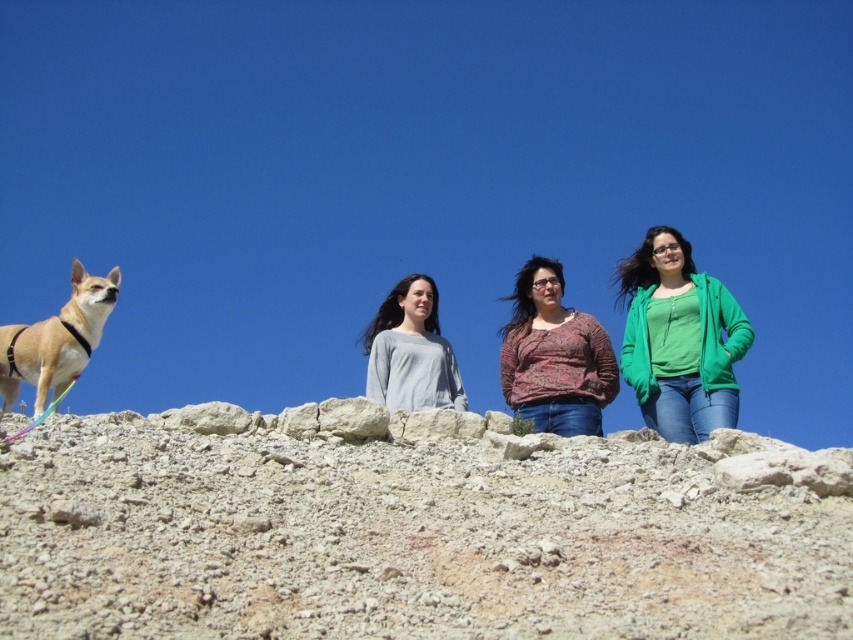
Question: Can you confirm if gray matte shirt at center is positioned to the right of light brown fur at left?

Choices:
 (A) yes
 (B) no

Answer: (A)

Question: Which point is closer to the camera?

Choices:
 (A) (718, 285)
 (B) (535, 472)

Answer: (B)

Question: Which object is positioned farthest from the printed cotton shirt at center?

Choices:
 (A) rough textured dirt at center
 (B) light brown fur at left
 (C) green matte jacket at right
 (D) gray matte shirt at center

Answer: (B)

Question: Is gray matte shirt at center to the left of light brown fur at left from the viewer's perspective?

Choices:
 (A) no
 (B) yes

Answer: (A)

Question: Among these objects, which one is farthest from the camera?

Choices:
 (A) green matte jacket at right
 (B) light brown fur at left

Answer: (A)

Question: Is green matte jacket at right bigger than light brown fur at left?

Choices:
 (A) no
 (B) yes

Answer: (B)